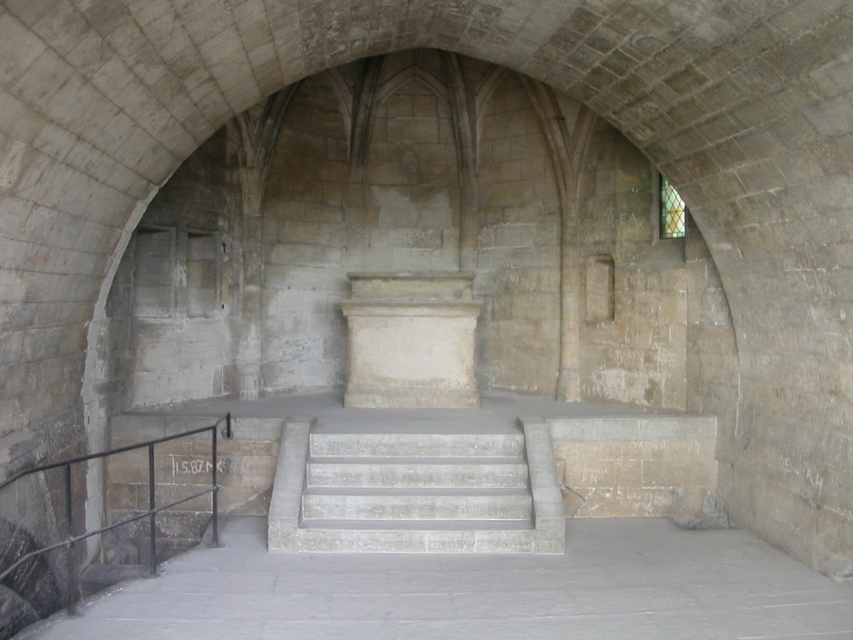
Question: Is smooth gray cement at lower center in front of white marble stairs at center?

Choices:
 (A) no
 (B) yes

Answer: (B)

Question: Which object is closer to the camera taking this photo?

Choices:
 (A) black metal/rail at lower left
 (B) white stone pedestal at center

Answer: (A)

Question: Which point is closer to the camera?

Choices:
 (A) smooth gray cement at lower center
 (B) white marble stairs at center
 (C) white stone pedestal at center

Answer: (A)

Question: In this image, where is smooth gray cement at lower center located relative to white stone pedestal at center?

Choices:
 (A) above
 (B) below

Answer: (B)

Question: Among these points, which one is nearest to the camera?

Choices:
 (A) (457, 488)
 (B) (141, 444)
 (C) (502, 586)

Answer: (C)

Question: Can you confirm if white marble stairs at center is positioned to the right of black metal/rail at lower left?

Choices:
 (A) yes
 (B) no

Answer: (A)